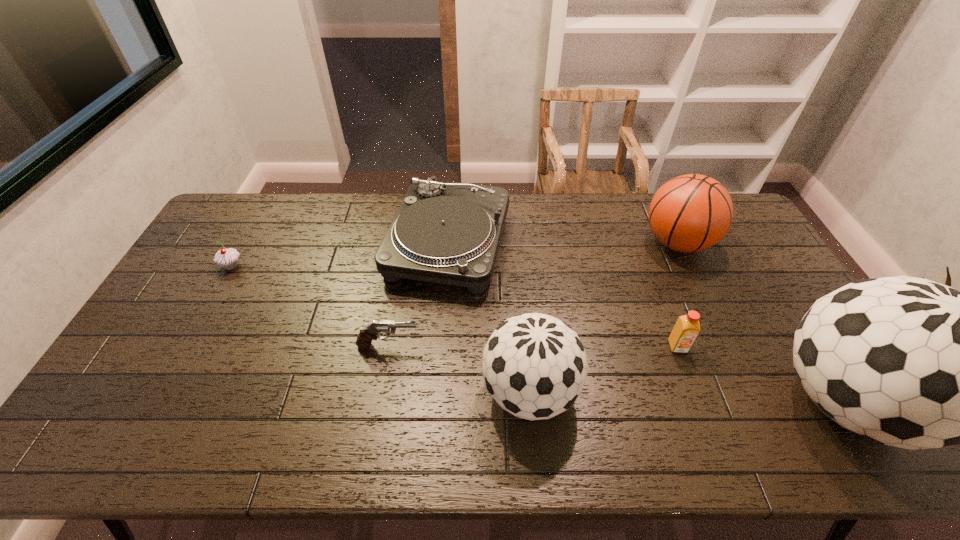
The width and height of the screenshot is (960, 540). In the image, there is a desktop. In order to click on vacant region at the left edge in this screenshot , I will do `click(186, 288)`.

The height and width of the screenshot is (540, 960). In order to click on free space at the right edge of the desktop in this screenshot , I will do `click(772, 286)`.

Where is `vacant point located between the cupcake and the orange juice`? This screenshot has height=540, width=960. vacant point located between the cupcake and the orange juice is located at coordinates (454, 306).

Identify the location of empty space between the pistol and the record player. (419, 295).

The height and width of the screenshot is (540, 960). What are the coordinates of `free area in between the pistol and the left soccer ball` in the screenshot? It's located at (459, 369).

The image size is (960, 540). I want to click on free space between the record player and the orange juice, so click(564, 295).

Locate an element on the screen. This screenshot has width=960, height=540. vacant space that is in between the left soccer ball and the pistol is located at coordinates (459, 369).

The image size is (960, 540). I want to click on free point between the pistol and the leftmost object, so click(310, 306).

At what (x,y) coordinates should I click in order to perform the action: click on the closest object relative to the orange juice. Please return your answer as a coordinate pair (x, y). Looking at the image, I should click on (908, 362).

This screenshot has height=540, width=960. In order to click on the sixth closest object to the orange juice in this screenshot , I will do `click(227, 258)`.